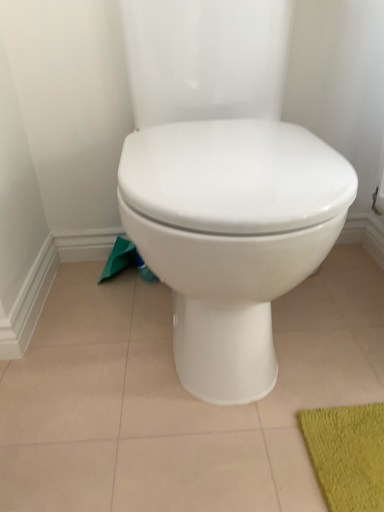
Question: Is green fabric toilet paper at lower left bigger or smaller than white glossy toilet at center?

Choices:
 (A) small
 (B) big

Answer: (A)

Question: In the image, is green fabric toilet paper at lower left positioned in front of or behind white glossy toilet at center?

Choices:
 (A) front
 (B) behind

Answer: (B)

Question: Is green fabric toilet paper at lower left wider or thinner than white glossy toilet at center?

Choices:
 (A) wide
 (B) thin

Answer: (B)

Question: Relative to green fabric toilet paper at lower left, is white glossy toilet at center in front or behind?

Choices:
 (A) behind
 (B) front

Answer: (B)

Question: From their relative heights in the image, would you say white glossy toilet at center is taller or shorter than green fabric toilet paper at lower left?

Choices:
 (A) short
 (B) tall

Answer: (B)

Question: From the image's perspective, is white glossy toilet at center above or below green fabric toilet paper at lower left?

Choices:
 (A) above
 (B) below

Answer: (A)

Question: Looking at their shapes, would you say white glossy toilet at center is wider or thinner than green fabric toilet paper at lower left?

Choices:
 (A) thin
 (B) wide

Answer: (B)